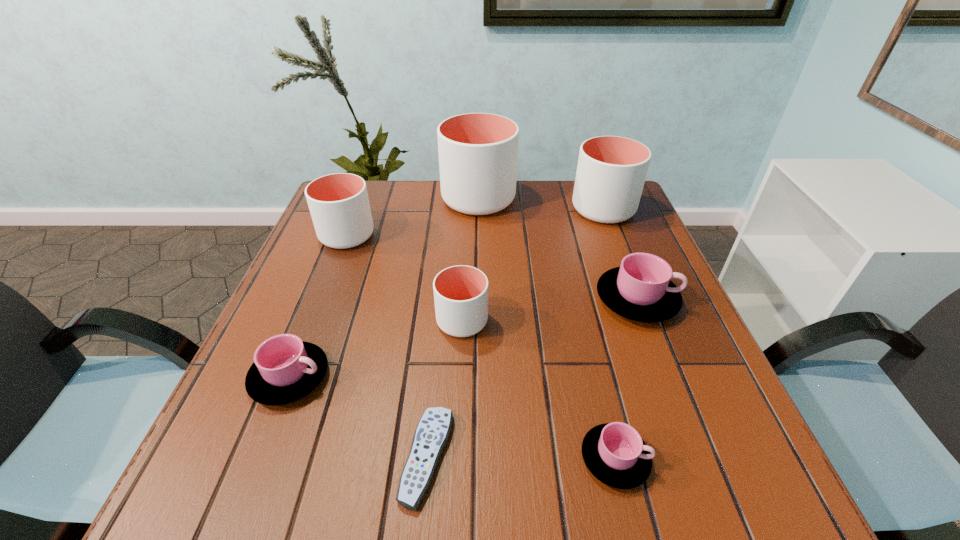
Identify the location of the second biggest pink cup. (285, 369).

The height and width of the screenshot is (540, 960). What are the coordinates of `the second nearest cup` in the screenshot? It's located at (285, 369).

Where is `the seventh tallest object`? The height and width of the screenshot is (540, 960). the seventh tallest object is located at coordinates (615, 453).

I want to click on the shortest cup, so click(x=615, y=453).

You are a GUI agent. You are given a task and a screenshot of the screen. Output one action in this format:
    pyautogui.click(x=<x>, y=<y>)
    Task: Click on the shortest object
    
    Given the screenshot: What is the action you would take?
    pyautogui.click(x=431, y=435)

Locate an element on the screen. The width and height of the screenshot is (960, 540). vacant point located on the left of the biggest white cup is located at coordinates (391, 199).

Identify the location of free space located 0.100m on the front of the second tallest cup. (619, 250).

I want to click on vacant region located on the right of the third biggest white cup, so tap(519, 235).

Where is `vacant region located on the front of the nearest white cup`? vacant region located on the front of the nearest white cup is located at coordinates (456, 461).

The height and width of the screenshot is (540, 960). Identify the location of vacant area situated 0.300m on the side with the handle of the leftmost pink cup. (491, 377).